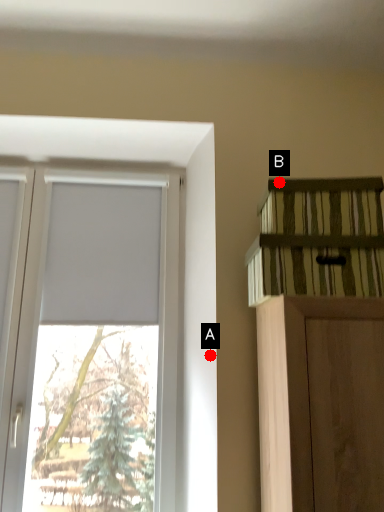
Question: Two points are circled on the image, labeled by A and B beside each circle. Which of the following is the closest to the observer?

Choices:
 (A) A is closer
 (B) B is closer

Answer: (B)